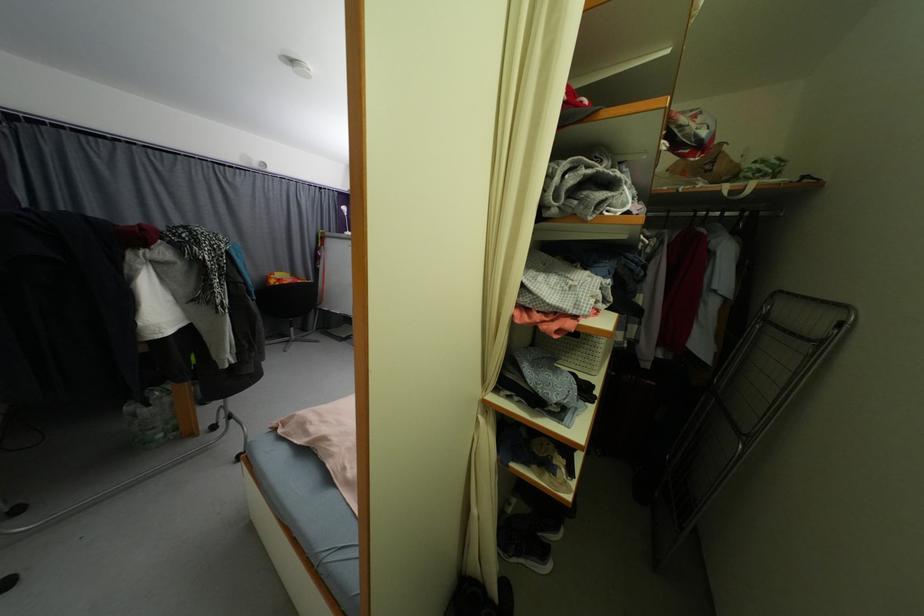
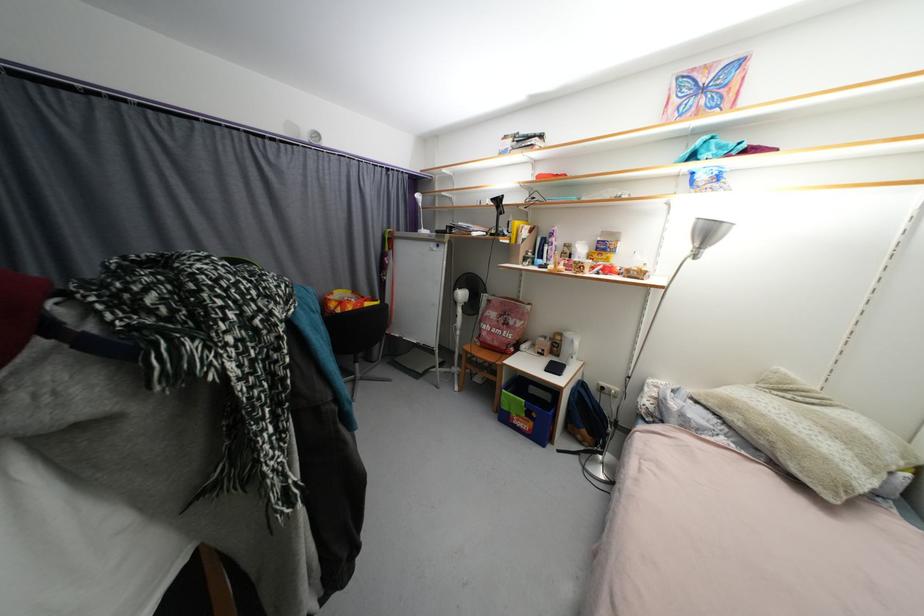
What movement of the cameraman would produce the second image?

The cameraman walked toward left, forward.